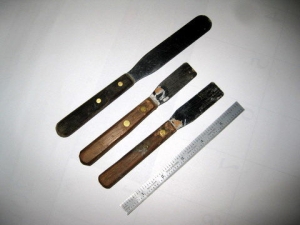
You are a GUI agent. You are given a task and a screenshot of the screen. Output one action in this format:
    pyautogui.click(x=<x>, y=<y>)
    Task: Click on the 12" ruler
    Image resolution: width=300 pixels, height=225 pixels.
    Given the screenshot: What is the action you would take?
    [x=229, y=199]